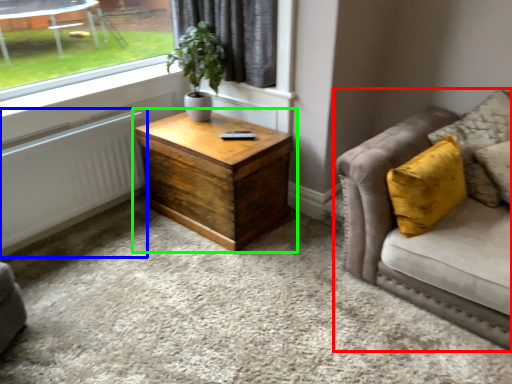
Question: Which object is positioned farthest from studio couch (highlighted by a red box)? Select from radiator (highlighted by a blue box) and coffee table (highlighted by a green box).

Choices:
 (A) radiator
 (B) coffee table

Answer: (A)